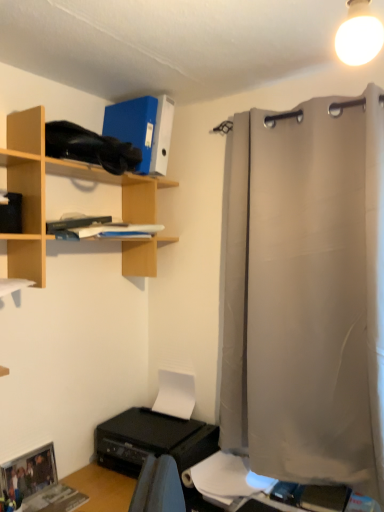
What do you see at coordinates (359, 34) in the screenshot? I see `white glossy light bulb at upper right` at bounding box center [359, 34].

What do you see at coordinates (175, 394) in the screenshot?
I see `white matte paper at lower center` at bounding box center [175, 394].

Identify the location of white matte book at upper center. The width and height of the screenshot is (384, 512). (99, 228).

Where is `printer located underneath the light gray fabric curtain at right (from a real-world perspective)`? The height and width of the screenshot is (512, 384). printer located underneath the light gray fabric curtain at right (from a real-world perspective) is located at coordinates (152, 440).

From the image's perspective, is light gray fabric curtain at right on top of black plastic printer at lower left?

Yes, from the image's perspective, light gray fabric curtain at right is over black plastic printer at lower left.

From a real-world perspective, is light gray fabric curtain at right over black plastic printer at lower left?

Correct, in the physical world, light gray fabric curtain at right is higher than black plastic printer at lower left.

Is light gray fabric curtain at right looking in the opposite direction of black plastic printer at lower left?

No, light gray fabric curtain at right is not facing the opposite direction of black plastic printer at lower left.

Considering the relative sizes of white paper at lower center and wooden shelf at upper left in the image provided, is white paper at lower center shorter than wooden shelf at upper left?

Indeed, white paper at lower center has a lesser height compared to wooden shelf at upper left.

Considering the relative sizes of white paper at lower center and wooden shelf at upper left in the image provided, is white paper at lower center wider than wooden shelf at upper left?

Correct, the width of white paper at lower center exceeds that of wooden shelf at upper left.

Can you confirm if white paper at lower center is smaller than wooden shelf at upper left?

Yes, white paper at lower center is smaller than wooden shelf at upper left.

Is white paper at lower center further to camera compared to wooden shelf at upper left?

Yes, white paper at lower center is further from the viewer.

Can you confirm if black plastic printer at lower left is bigger than white paper at lower center?

Correct, black plastic printer at lower left is larger in size than white paper at lower center.

Is black plastic printer at lower left oriented towards white paper at lower center?

No, black plastic printer at lower left does not turn towards white paper at lower center.

From a real-world perspective, between black plastic printer at lower left and white paper at lower center, who is vertically higher?

From a 3D spatial view, black plastic printer at lower left is above.

Measure the distance between black plastic printer at lower left and white paper at lower center.

The distance of black plastic printer at lower left from white paper at lower center is 7.43 inches.

Between white paper at lower center and white matte book at upper center, which one appears on the right side from the viewer's perspective?

Answer: From the viewer's perspective, white paper at lower center appears more on the right side.

Locate an element on the screen. book on the left side of white paper at lower center is located at coordinates (99, 228).

Which is less distant, (222, 493) or (80, 238)?

The point (222, 493) is more forward.

Considering their positions, is white paper at lower center located in front of or behind white matte book at upper center?

Clearly, white paper at lower center is behind white matte book at upper center.

Considering the sizes of objects light gray fabric curtain at right and white matte paper at lower center in the image provided, who is bigger, light gray fabric curtain at right or white matte paper at lower center?

With larger size is light gray fabric curtain at right.

From a real-world perspective, relative to white matte paper at lower center, is light gray fabric curtain at right vertically above or below?

From a real-world perspective, light gray fabric curtain at right is physically above white matte paper at lower center.

From the image's perspective, between light gray fabric curtain at right and white matte paper at lower center, who is located below?

white matte paper at lower center is shown below in the image.

Is light gray fabric curtain at right far away from white matte paper at lower center?

Actually, light gray fabric curtain at right and white matte paper at lower center are a little close together.

Is wooden shelf at upper left oriented away from white matte paper at lower center?

No, wooden shelf at upper left's orientation is not away from white matte paper at lower center.

Is white matte paper at lower center completely or partially inside wooden shelf at upper left?

That's incorrect, white matte paper at lower center is not inside wooden shelf at upper left.

Between wooden shelf at upper left and white matte paper at lower center, which one has larger size?

Bigger between the two is wooden shelf at upper left.

Between wooden shelf at upper left and white matte paper at lower center, which one has larger width?

Wider between the two is wooden shelf at upper left.

Considering the relative sizes of white matte paper at lower center and black plastic printer at lower left in the image provided, is white matte paper at lower center wider than black plastic printer at lower left?

No, white matte paper at lower center is not wider than black plastic printer at lower left.

Based on their positions, is white matte paper at lower center located to the left or right of black plastic printer at lower left?

Clearly, white matte paper at lower center is on the right of black plastic printer at lower left in the image.

Is white matte paper at lower center touching black plastic printer at lower left?

No, white matte paper at lower center is not beside black plastic printer at lower left.

Does white matte paper at lower center turn towards black plastic printer at lower left?

No, white matte paper at lower center is not aimed at black plastic printer at lower left.

Find the location of a particular element. The image size is (384, 512). shower curtain located above the black plastic printer at lower left (from a real-world perspective) is located at coordinates (307, 293).

In the image, there is a wooden shelf at upper left. At what (x,y) coordinates should I click in order to perform the action: click on sheet below it (from a real-world perspective). Please return your answer as a coordinate pair (x, y). Looking at the image, I should click on (226, 478).

From the image, which object appears to be nearer to wooden shelf at upper left, white matte book at upper center or white matte paper at lower center?

white matte book at upper center is closer to wooden shelf at upper left.

Estimate the real-world distances between objects in this image. Which object is closer to white glossy light bulb at upper right, wooden shelf at upper left or black plastic printer at lower left?

wooden shelf at upper left is positioned closer to the anchor white glossy light bulb at upper right.

Based on their spatial positions, is white matte book at upper center or black plastic printer at lower left closer to white matte paper at lower center?

The object closer to white matte paper at lower center is black plastic printer at lower left.

Looking at the image, which one is located closer to white matte paper at lower center, black plastic printer at lower left or white matte book at upper center?

black plastic printer at lower left is positioned closer to the anchor white matte paper at lower center.

Based on the photo, from the image, which object appears to be nearer to white paper at lower center, white matte paper at lower center or wooden shelf at upper left?

white matte paper at lower center lies closer to white paper at lower center than the other object.

From the image, which object appears to be farther from white paper at lower center, black plastic printer at lower left or white matte book at upper center?

white matte book at upper center.

From the image, which object appears to be farther from white matte book at upper center, white paper at lower center or white matte paper at lower center?

white paper at lower center lies further to white matte book at upper center than the other object.

Estimate the real-world distances between objects in this image. Which object is closer to white matte paper at lower center, light gray fabric curtain at right or white glossy light bulb at upper right?

Based on the image, light gray fabric curtain at right appears to be nearer to white matte paper at lower center.

Identify the location of printer between light gray fabric curtain at right and white paper at lower center from top to bottom. 152,440.

At what (x,y) coordinates should I click in order to perform the action: click on book located between wooden shelf at upper left and light gray fabric curtain at right in the left-right direction. Please return your answer as a coordinate pair (x, y). Looking at the image, I should click on (99, 228).

Find the location of `shower curtain between white glossy light bulb at upper right and black plastic printer at lower left vertically`. shower curtain between white glossy light bulb at upper right and black plastic printer at lower left vertically is located at coordinates (307, 293).

The image size is (384, 512). Find the location of `shower curtain that lies between white matte book at upper center and black plastic printer at lower left from top to bottom`. shower curtain that lies between white matte book at upper center and black plastic printer at lower left from top to bottom is located at coordinates (307, 293).